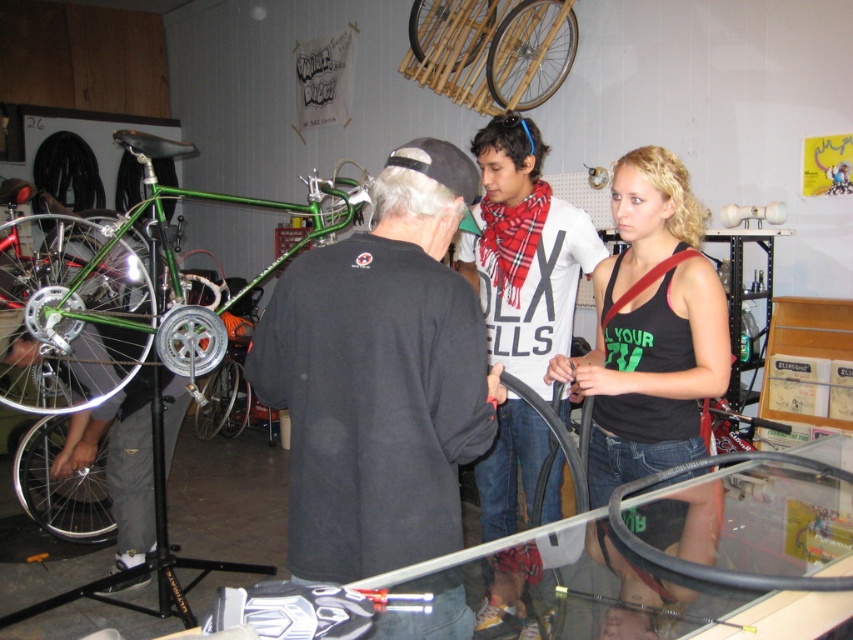
Question: Among these objects, which one is nearest to the camera?

Choices:
 (A) black tank top at center
 (B) red plaid scarf at center
 (C) green matte bicycle at upper center

Answer: (A)

Question: Which object is farther from the camera taking this photo?

Choices:
 (A) green matte bicycle at upper center
 (B) dark gray sweatshirt at center
 (C) black tank top at center

Answer: (A)

Question: Among these objects, which one is nearest to the camera?

Choices:
 (A) dark gray sweatshirt at center
 (B) red plaid scarf at center
 (C) green matte bicycle at upper center
 (D) black tank top at center

Answer: (A)

Question: Is dark gray sweatshirt at center positioned behind green matte bicycle at upper center?

Choices:
 (A) yes
 (B) no

Answer: (B)

Question: Can you confirm if black tank top at center is smaller than green matte bicycle at upper center?

Choices:
 (A) no
 (B) yes

Answer: (B)

Question: Can you confirm if dark gray sweatshirt at center is wider than green matte bicycle at upper center?

Choices:
 (A) no
 (B) yes

Answer: (A)